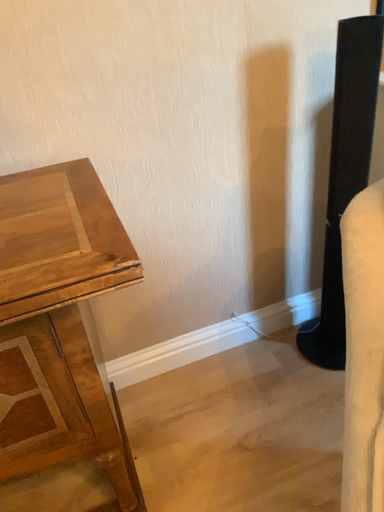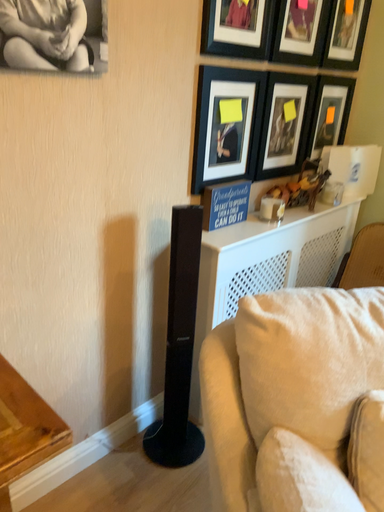
Question: Which way did the camera rotate in the video?

Choices:
 (A) rotated upward
 (B) rotated downward

Answer: (A)